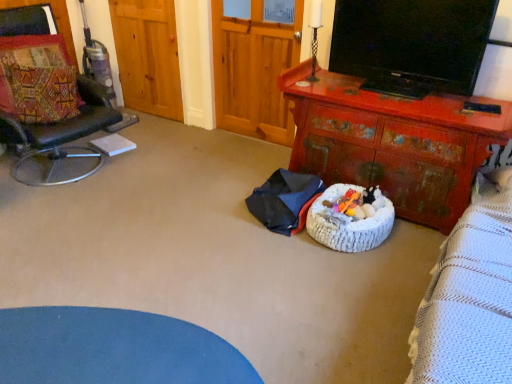
Question: Should I look upward or downward to see rusty wood desk at center?

Choices:
 (A) down
 (B) up

Answer: (B)

Question: Can you confirm if wooden armoire at center is positioned to the right of patchwork fabric pillow at left?

Choices:
 (A) yes
 (B) no

Answer: (A)

Question: Does wooden armoire at center have a lesser height compared to patchwork fabric pillow at left?

Choices:
 (A) yes
 (B) no

Answer: (B)

Question: Is wooden armoire at center taller than patchwork fabric pillow at left?

Choices:
 (A) yes
 (B) no

Answer: (A)

Question: Is wooden armoire at center in front of patchwork fabric pillow at left?

Choices:
 (A) yes
 (B) no

Answer: (B)

Question: Is wooden armoire at center behind patchwork fabric pillow at left?

Choices:
 (A) yes
 (B) no

Answer: (A)

Question: From a real-world perspective, is wooden armoire at center positioned over patchwork fabric pillow at left based on gravity?

Choices:
 (A) yes
 (B) no

Answer: (B)

Question: Is patchwork fabric pillow at left not near wooden armoire at center?

Choices:
 (A) yes
 (B) no

Answer: (A)

Question: Considering the relative sizes of patchwork fabric pillow at left and wooden armoire at center in the image provided, is patchwork fabric pillow at left bigger than wooden armoire at center?

Choices:
 (A) yes
 (B) no

Answer: (B)

Question: Does patchwork fabric pillow at left turn towards wooden armoire at center?

Choices:
 (A) no
 (B) yes

Answer: (A)

Question: Is patchwork fabric pillow at left at the left side of wooden armoire at center?

Choices:
 (A) yes
 (B) no

Answer: (A)

Question: Is patchwork fabric pillow at left touching wooden armoire at center?

Choices:
 (A) no
 (B) yes

Answer: (A)

Question: Is patchwork fabric pillow at left thinner than wooden armoire at center?

Choices:
 (A) no
 (B) yes

Answer: (A)

Question: From a real-world perspective, does wooden armoire at center stand above black glossy tv at upper right?

Choices:
 (A) yes
 (B) no

Answer: (B)